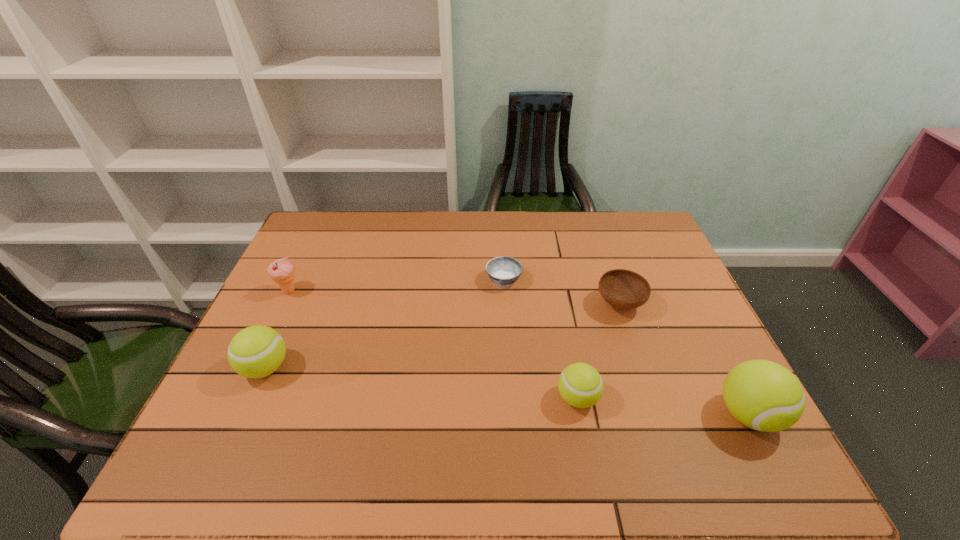
What are the coordinates of `vacant region that satisfies the following two spatial constraints: 1. on the front side of the icecream; 2. on the right side of the rightmost tennis ball` in the screenshot? It's located at (229, 415).